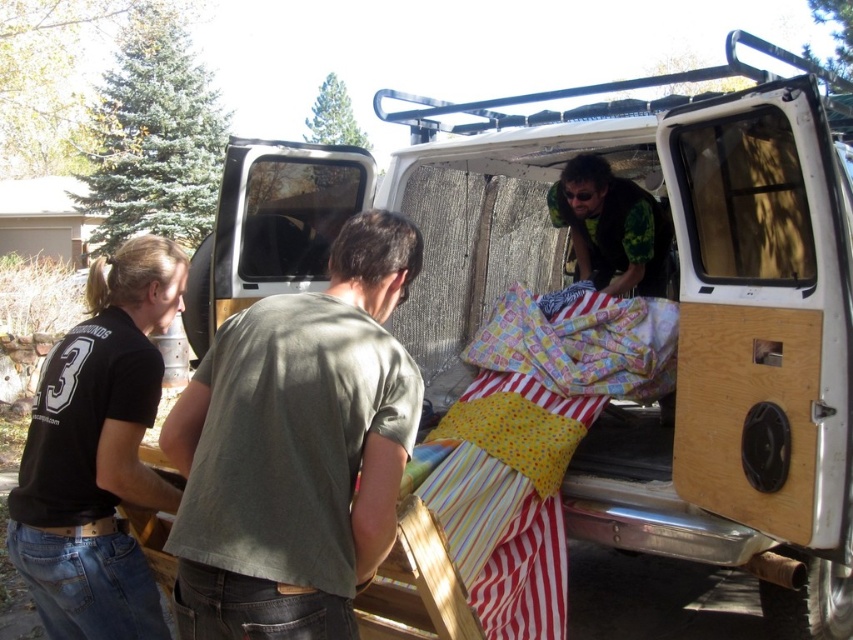
Question: Does green cotton shirt at center appear on the right side of green camouflage shirt at center?

Choices:
 (A) no
 (B) yes

Answer: (A)

Question: Is white wood van at center bigger than green cotton shirt at center?

Choices:
 (A) no
 (B) yes

Answer: (B)

Question: Which point appears closest to the camera in this image?

Choices:
 (A) (531, 134)
 (B) (100, 260)
 (C) (596, 188)

Answer: (A)

Question: Estimate the real-world distances between objects in this image. Which object is farther from the green camouflage shirt at center?

Choices:
 (A) green cotton shirt at center
 (B) white wood van at center
 (C) black cotton shirt at left

Answer: (C)

Question: Which point is closer to the camera?

Choices:
 (A) green cotton shirt at center
 (B) white wood van at center
 (C) black cotton shirt at left
 (D) green camouflage shirt at center

Answer: (A)

Question: Does white wood van at center have a smaller size compared to black cotton shirt at left?

Choices:
 (A) yes
 (B) no

Answer: (B)